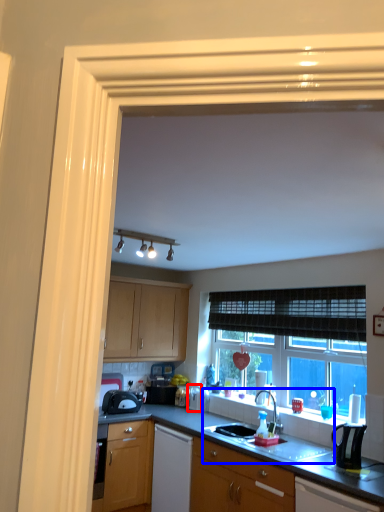
Question: Which point is closer to the camera, appliance (highlighted by a red box) or sink (highlighted by a blue box)?

Choices:
 (A) appliance
 (B) sink

Answer: (B)